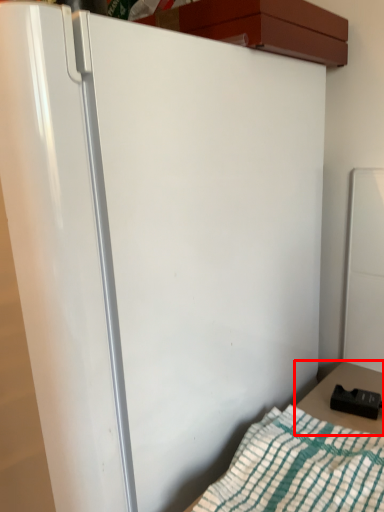
Question: Observing the image, what is the correct spatial positioning of table (annotated by the red box) in reference to blanket?

Choices:
 (A) right
 (B) left

Answer: (A)